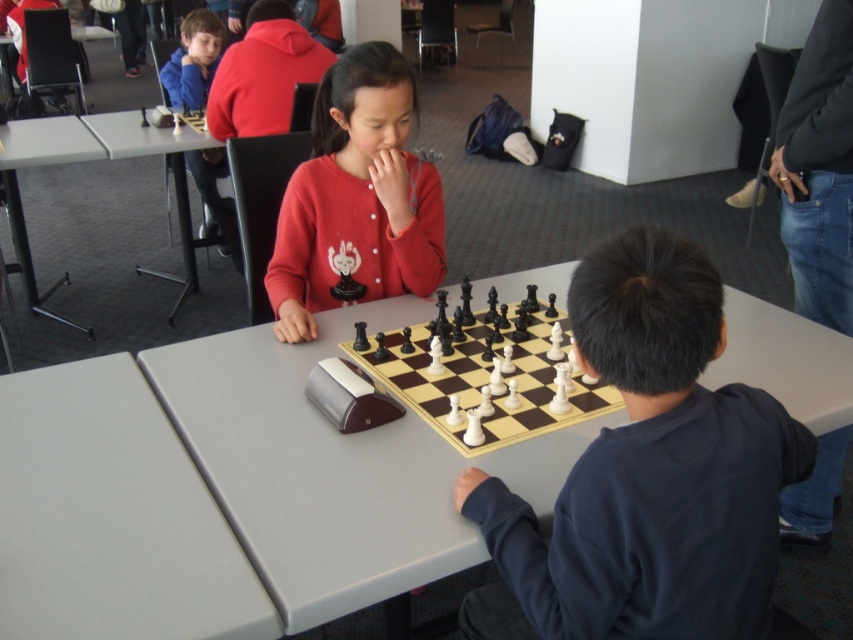
Between point (614, 253) and point (178, 298), which one is positioned in front?

Point (614, 253) is more forward.

Which is above, dark blue sweatshirt at right or gray plastic table at upper left?

Positioned higher is gray plastic table at upper left.

Between point (679, 244) and point (125, 132), which one is positioned in front?

Point (679, 244)

The width and height of the screenshot is (853, 640). Find the location of `dark blue sweatshirt at right`. dark blue sweatshirt at right is located at coordinates (646, 472).

Can you confirm if black glossy chess set at center is positioned below gray plastic table at upper left?

Yes, black glossy chess set at center is below gray plastic table at upper left.

Is black glossy chess set at center to the left of gray plastic table at upper left from the viewer's perspective?

Incorrect, black glossy chess set at center is not on the left side of gray plastic table at upper left.

What do you see at coordinates (489, 376) in the screenshot? I see `black glossy chess set at center` at bounding box center [489, 376].

Where is `black glossy chess set at center`? This screenshot has height=640, width=853. black glossy chess set at center is located at coordinates (489, 376).

Can you confirm if gray plastic table at lower left is taller than gray plastic table at upper left?

Correct, gray plastic table at lower left is much taller as gray plastic table at upper left.

You are a GUI agent. You are given a task and a screenshot of the screen. Output one action in this format:
    pyautogui.click(x=<x>, y=<y>)
    Task: Click on the gray plastic table at lower left
    The width and height of the screenshot is (853, 640).
    Given the screenshot: What is the action you would take?
    pyautogui.click(x=18, y=188)

Identify the location of gray plastic table at lower left. (18, 188).